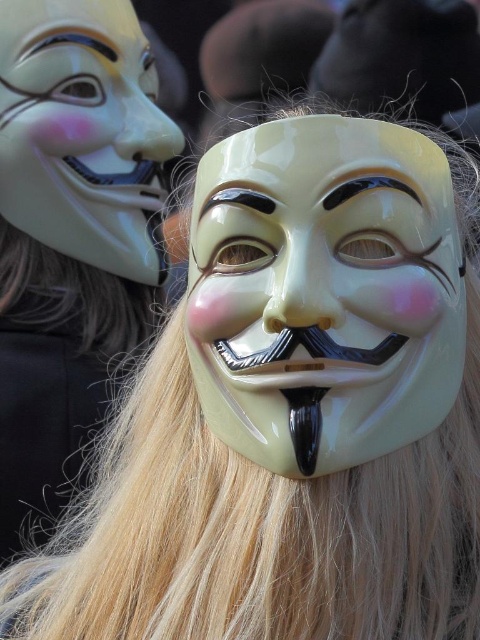
From the picture: Can you confirm if glossy plastic mask at center is positioned below matte white mask at upper center?

Correct, glossy plastic mask at center is located below matte white mask at upper center.

Between point (315, 413) and point (9, 164), which one is positioned behind?

Point (9, 164)

I want to click on glossy plastic mask at center, so tap(324, 291).